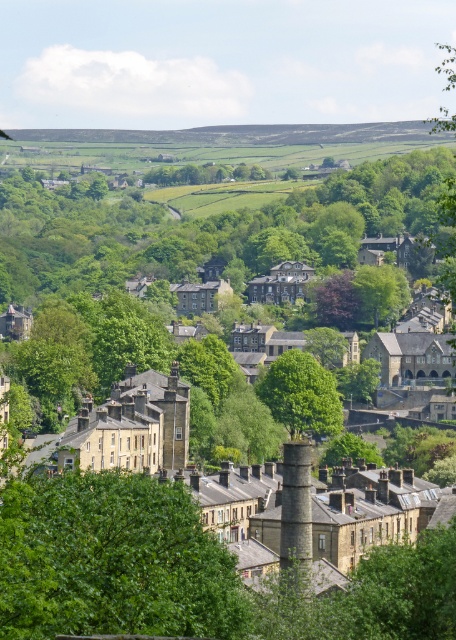
Question: Which of the following is the farthest from the observer?

Choices:
 (A) (286, 545)
 (B) (281, 372)

Answer: (B)

Question: Considering the relative positions of green leafy tree at center and stone chimney at center in the image provided, where is green leafy tree at center located with respect to stone chimney at center?

Choices:
 (A) left
 (B) right

Answer: (B)

Question: Does green leafy tree at center come in front of stone chimney at center?

Choices:
 (A) yes
 (B) no

Answer: (B)

Question: Is green leafy tree at center wider than stone chimney at center?

Choices:
 (A) yes
 (B) no

Answer: (A)